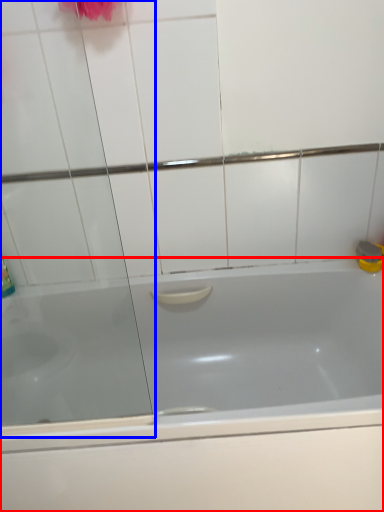
Question: Among these objects, which one is farthest to the camera, bathtub (highlighted by a red box) or screen door (highlighted by a blue box)?

Choices:
 (A) bathtub
 (B) screen door

Answer: (A)